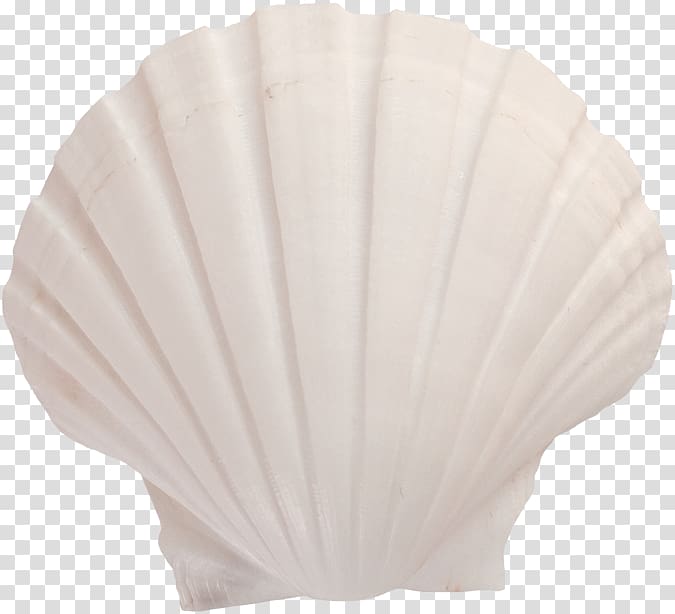
Identify the location of tile background beneath shell. (385, 600).